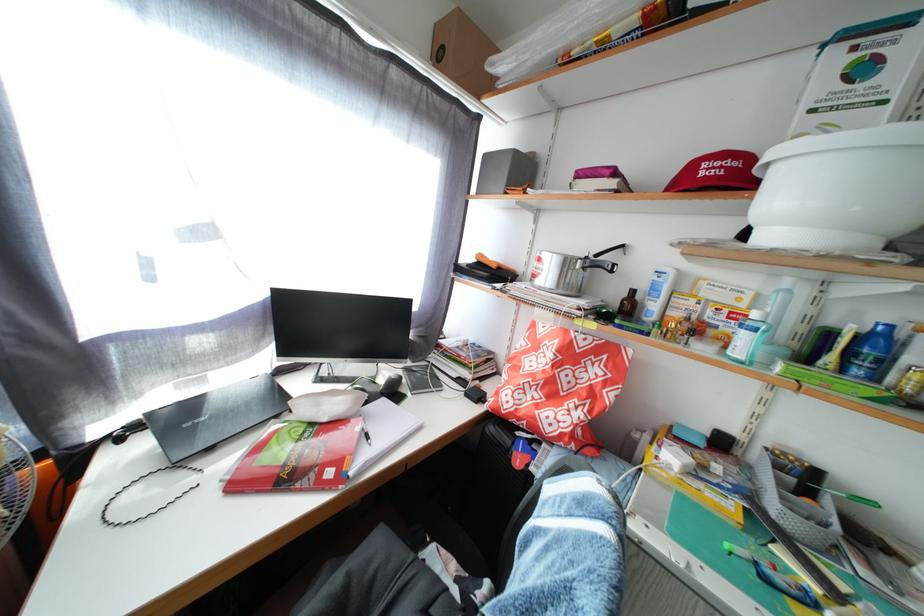
I want to click on cardboard box, so click(x=463, y=53).